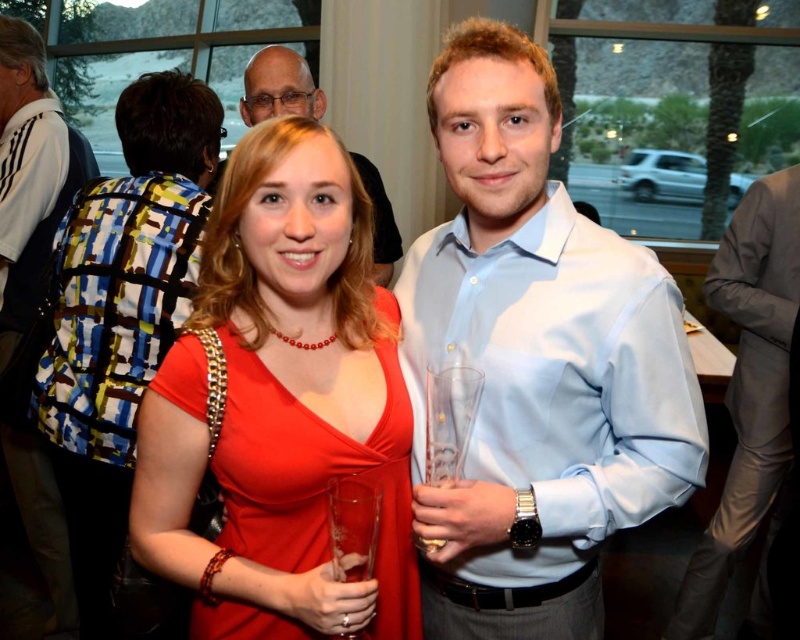
Question: Does blue-and-white backpack at left appear over matte black glasses at upper center?

Choices:
 (A) no
 (B) yes

Answer: (A)

Question: Which point appears closest to the camera in this image?

Choices:
 (A) (249, 113)
 (B) (762, 211)
 (C) (266, 534)

Answer: (C)

Question: Is matte red dress at center thinner than light gray suit at right?

Choices:
 (A) yes
 (B) no

Answer: (A)

Question: Which of the following is the closest to the observer?

Choices:
 (A) matte black glasses at upper center
 (B) matte red dress at center
 (C) light blue shirt at center
 (D) blue-and-white backpack at left

Answer: (B)

Question: Is light gray suit at right to the right of blue-and-white backpack at left from the viewer's perspective?

Choices:
 (A) yes
 (B) no

Answer: (A)

Question: Which is nearer to the light gray suit at right?

Choices:
 (A) matte black glasses at upper center
 (B) blue-and-white backpack at left
 (C) matte red dress at center

Answer: (A)